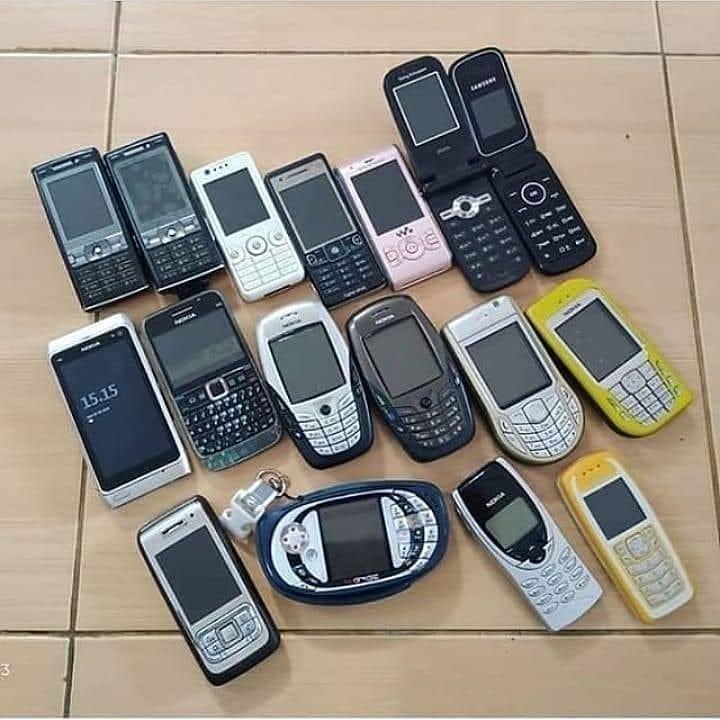
The height and width of the screenshot is (720, 720). Find the location of `tiles`. tiles is located at coordinates (78, 22), (224, 27), (688, 36), (698, 109), (630, 179), (32, 433), (27, 665), (135, 684).